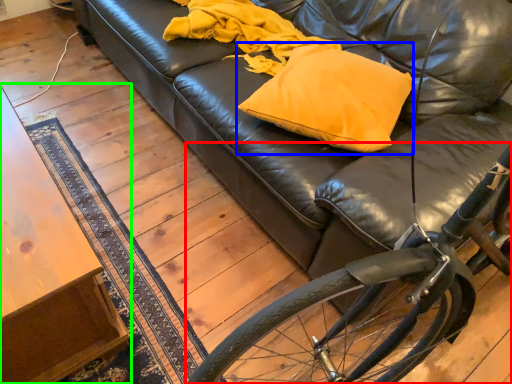
Question: Which object is the closest to the bicycle (highlighted by a red box)? Choose among these: throw pillow (highlighted by a blue box) or table (highlighted by a green box).

Choices:
 (A) throw pillow
 (B) table

Answer: (A)